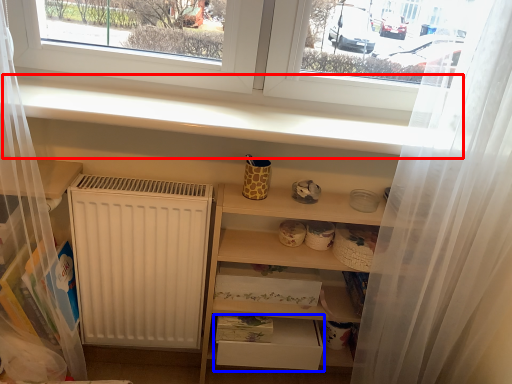
Question: Which object appears farthest to the camera in this image, window sill (highlighted by a red box) or drawer (highlighted by a blue box)?

Choices:
 (A) window sill
 (B) drawer

Answer: (B)